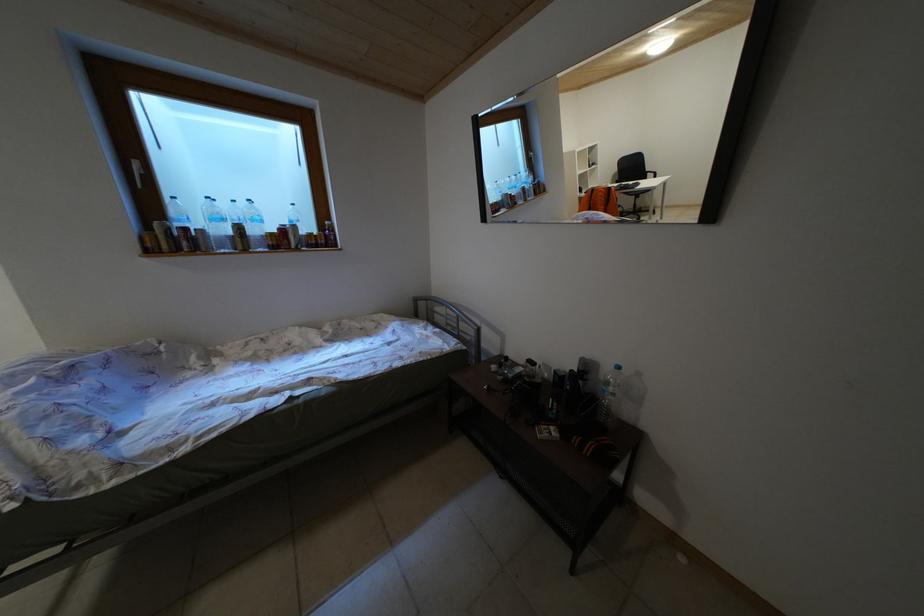
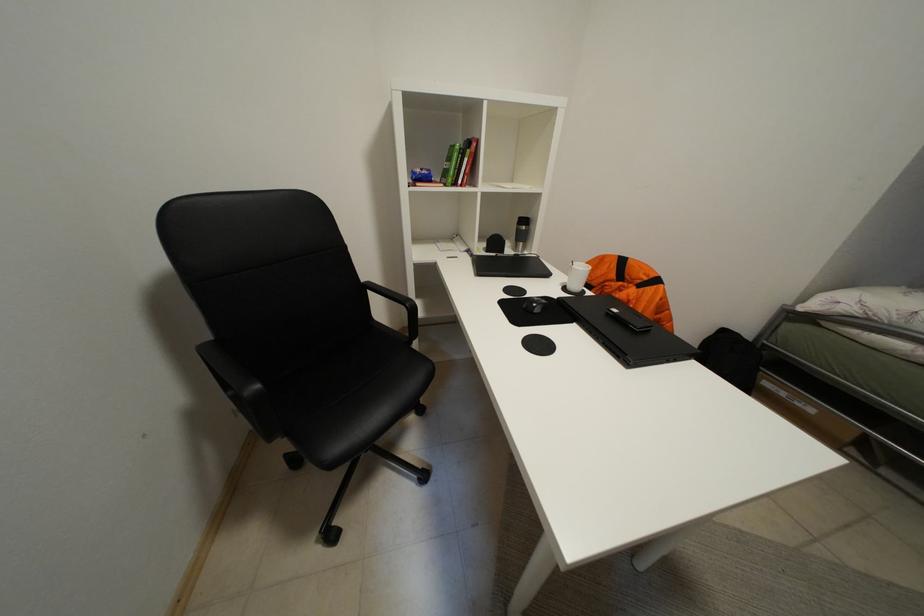
Question: In a continuous first-person perspective shot, in which direction is the camera moving?

Choices:
 (A) Left
 (B) Right
 (C) Forward
 (D) Backward

Answer: (A)